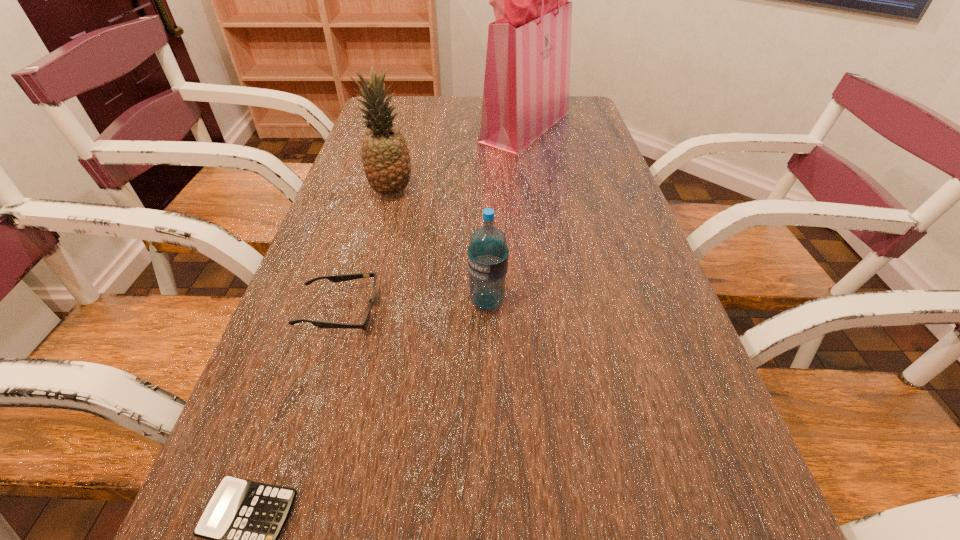
Locate an element on the screen. shopping bag is located at coordinates 527,75.

You are a GUI agent. You are given a task and a screenshot of the screen. Output one action in this format:
    pyautogui.click(x=<x>, y=<y>)
    Task: Click on the farthest object
    The image size is (960, 540).
    Given the screenshot: What is the action you would take?
    pyautogui.click(x=527, y=75)

Locate an element on the screen. pineapple is located at coordinates (385, 156).

At what (x,y) coordinates should I click in order to perform the action: click on the second farthest object. Please return your answer as a coordinate pair (x, y). The height and width of the screenshot is (540, 960). Looking at the image, I should click on (385, 156).

You are a GUI agent. You are given a task and a screenshot of the screen. Output one action in this format:
    pyautogui.click(x=<x>, y=<y>)
    Task: Click on the water bottle
    The image size is (960, 540).
    Given the screenshot: What is the action you would take?
    pyautogui.click(x=487, y=256)

Find the location of `the second shortest object`. the second shortest object is located at coordinates (344, 277).

Locate an element on the screen. free space located 0.230m on the left of the shopping bag is located at coordinates (406, 126).

The height and width of the screenshot is (540, 960). I want to click on vacant space located 0.210m on the front of the second farthest object, so click(x=373, y=259).

This screenshot has height=540, width=960. I want to click on vacant space located on the right of the third tallest object, so click(616, 301).

I want to click on vacant space located on the front-facing side of the second shortest object, so click(428, 312).